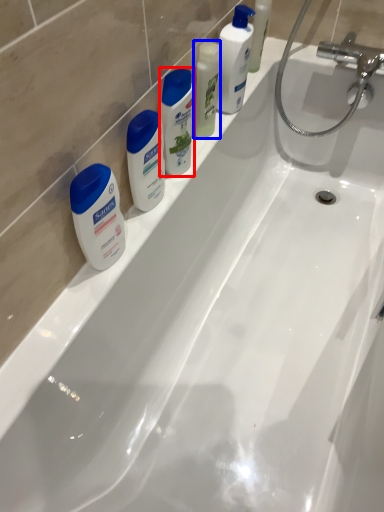
Question: Among these objects, which one is nearest to the camera, cleaning product (highlighted by a red box) or cleaning product (highlighted by a blue box)?

Choices:
 (A) cleaning product
 (B) cleaning product

Answer: (A)